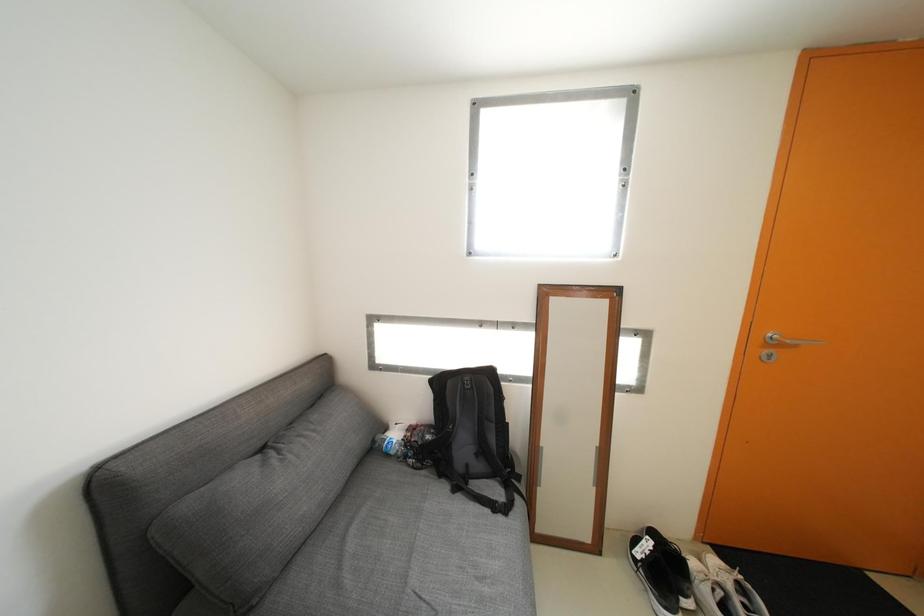
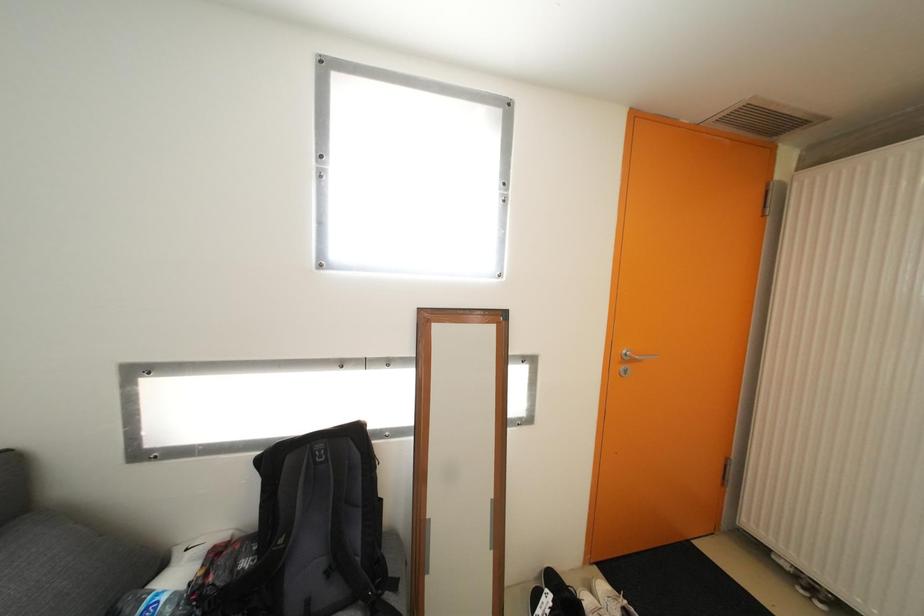
Which direction would the cameraman need to move to produce the second image?

The cameraman walked toward right, forward.